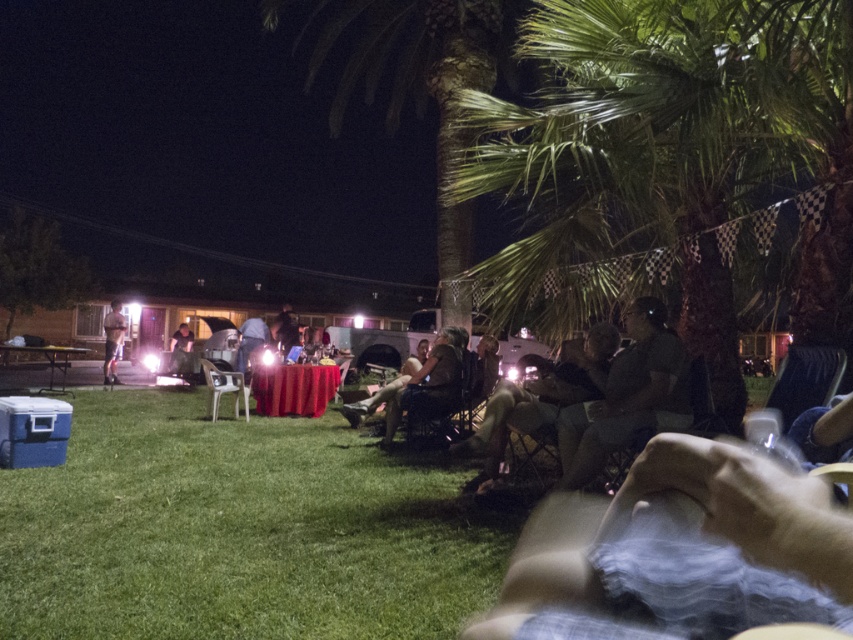
Question: Can you confirm if dark green fabric chair at center right is wider than dark green fabric chair at center?

Choices:
 (A) yes
 (B) no

Answer: (B)

Question: Considering the relative positions of green leafy palm tree at upper right and dark green fabric chair at center right in the image provided, where is green leafy palm tree at upper right located with respect to dark green fabric chair at center right?

Choices:
 (A) above
 (B) below

Answer: (A)

Question: Estimate the real-world distances between objects in this image. Which object is farther from the matte black shirt at center?

Choices:
 (A) green leafy palm tree at upper right
 (B) green grass at lower left

Answer: (A)

Question: Which of these objects is positioned closest to the dark fabric jacket at center?

Choices:
 (A) green leafy palm tree at upper right
 (B) matte black chair at center

Answer: (B)

Question: Which point is farther to the camera?

Choices:
 (A) (428, 376)
 (B) (242, 356)
 (C) (505, 403)

Answer: (B)

Question: Can you confirm if matte black shirt at center is positioned above dark fabric jacket at center?

Choices:
 (A) no
 (B) yes

Answer: (B)